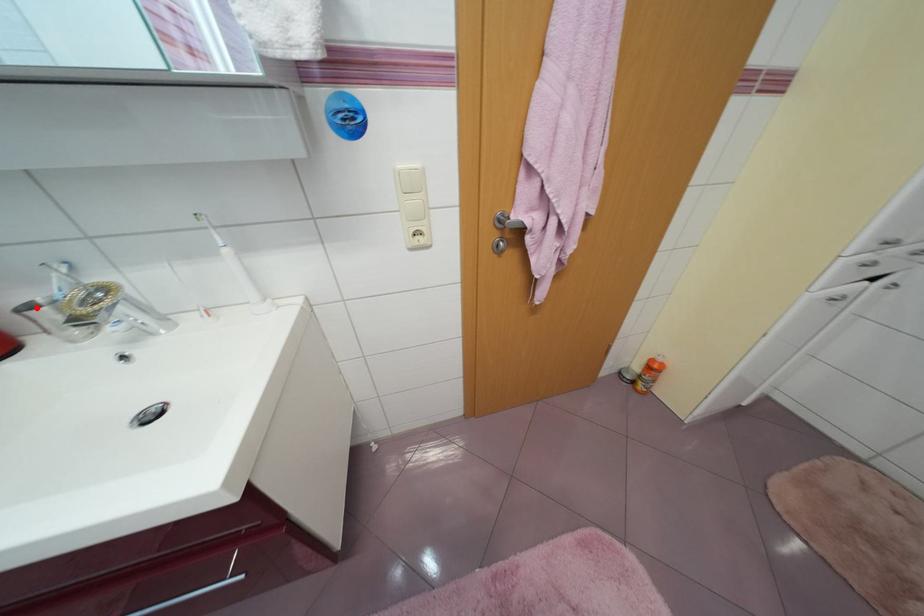
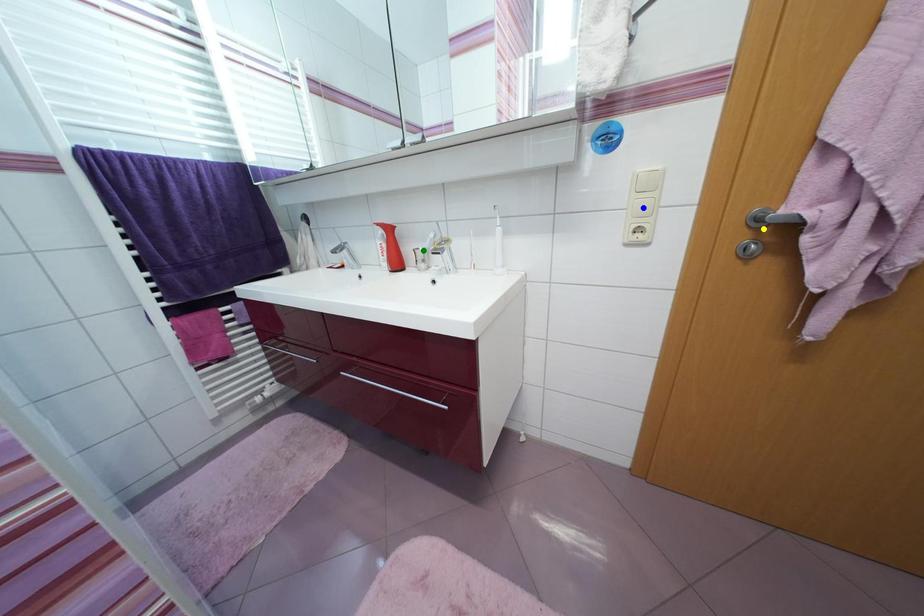
Question: I am providing you with two images of the same scene from different viewpoints. A red point is marked on the first image. You are given multiple points on the second image. Can you choose the point in image 2 that corresponds to the point in image 1?

Choices:
 (A) green point
 (B) blue point
 (C) yellow point

Answer: (A)